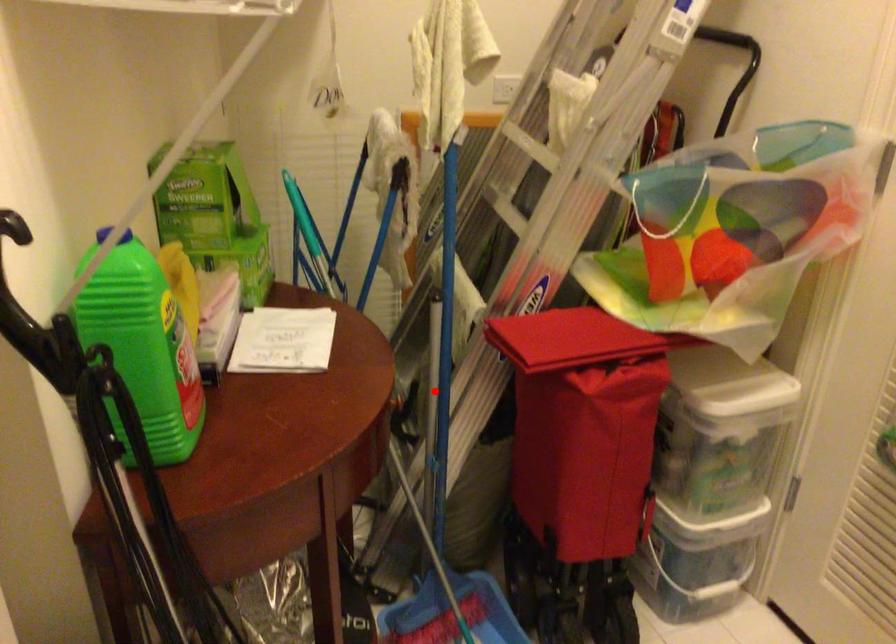
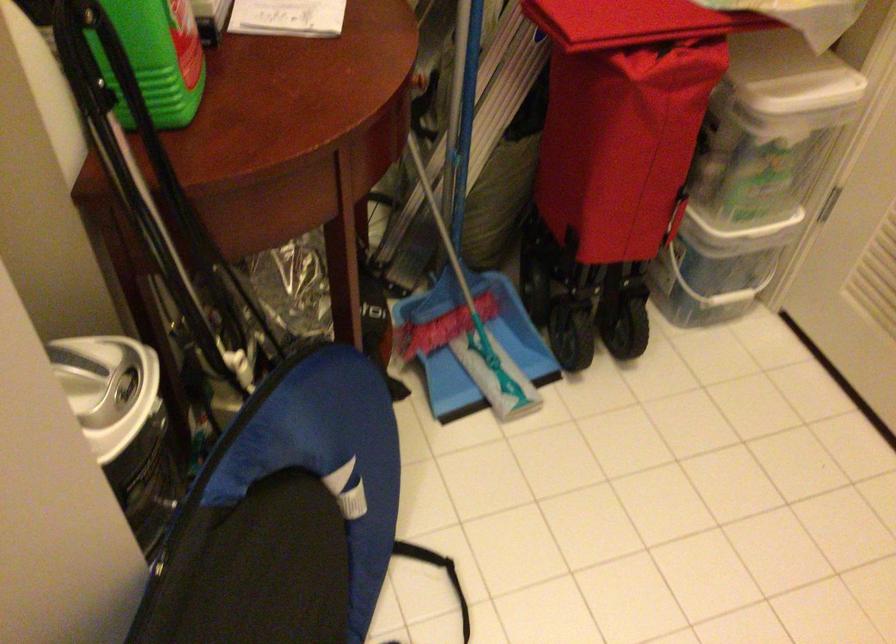
Question: I am providing you with two images of the same scene from different viewpoints. Given a red point in image1, look at the same physical point in image2. Is it:

Choices:
 (A) Closer to the viewpoint
 (B) Farther from the viewpoint

Answer: (A)